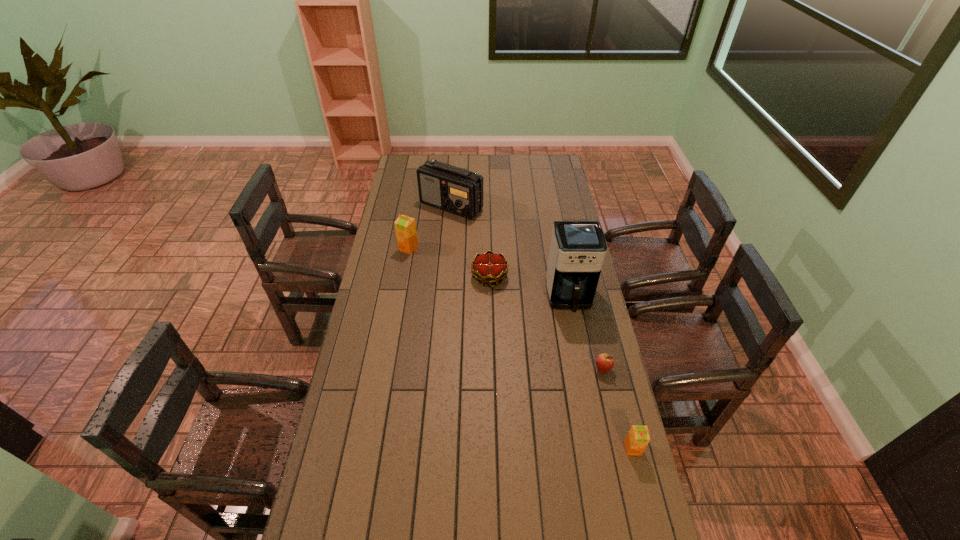
In the image, there is a desktop. Identify the location of free space at the far edge. (464, 156).

At what (x,y) coordinates should I click in order to perform the action: click on free space at the near edge. Please return your answer as a coordinate pair (x, y). Looking at the image, I should click on (493, 536).

In the image, there is a desktop. Where is `free region at the left edge`? The image size is (960, 540). free region at the left edge is located at coordinates (320, 492).

Where is `vacant space at the right edge of the desktop`? The image size is (960, 540). vacant space at the right edge of the desktop is located at coordinates (617, 397).

Where is `vacant area at the near left corner`? This screenshot has height=540, width=960. vacant area at the near left corner is located at coordinates (358, 502).

The image size is (960, 540). In order to click on blank space at the near right corner in this screenshot , I will do `click(591, 512)`.

Where is `vacant area that lies between the tallest object and the apple`? The width and height of the screenshot is (960, 540). vacant area that lies between the tallest object and the apple is located at coordinates (586, 333).

At what (x,y) coordinates should I click in order to perform the action: click on vacant area that lies between the crown and the fourth shortest object. Please return your answer as a coordinate pair (x, y). The width and height of the screenshot is (960, 540). Looking at the image, I should click on (449, 262).

You are a GUI agent. You are given a task and a screenshot of the screen. Output one action in this format:
    pyautogui.click(x=<x>, y=<y>)
    Task: Click on the vacant area that lies between the crown and the apple
    This screenshot has width=960, height=540.
    Given the screenshot: What is the action you would take?
    point(546,323)

This screenshot has width=960, height=540. In order to click on free space between the crown and the fifth farthest object in this screenshot , I will do `click(546, 323)`.